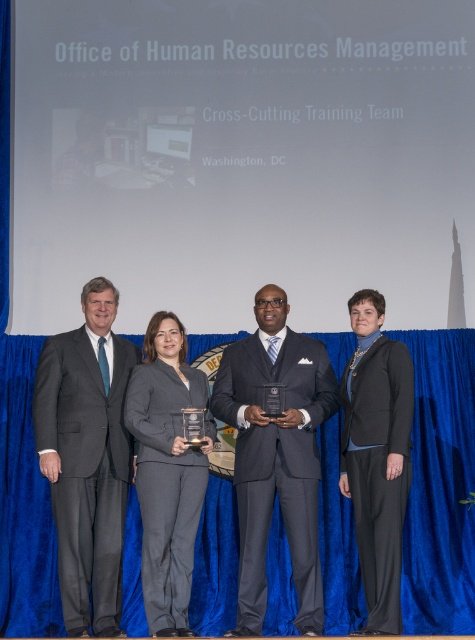
You are an event photographer who needs to adjust the lighting so that both the charcoal gray suit at left and the matte black suit at center are equally visible. Based on their positions, which suit is higher up and might need more or less light adjustment?

The charcoal gray suit at left is located above the matte black suit at center, so it might need more light adjustment to ensure it is equally visible.

At the formal event, you notice two individuals wearing gray suits. The first is the charcoal gray suit at left and the second is the gray suit at center. Which of these two gray suits appears larger in size?

The charcoal gray suit at left appears larger in size than the gray suit at center.

You are standing in front of the stage at the formal event. There are two points marked on the stage floor. The first point is at coordinates point (239,356) and the second point is at point (152,364). If you want to place a small decorative item on the stage floor, which point should you choose so that it appears closer to the audience?

You should place the small decorative item at point (239,356) because it is further to the viewer than point (152,364), making it appear closer to the audience.